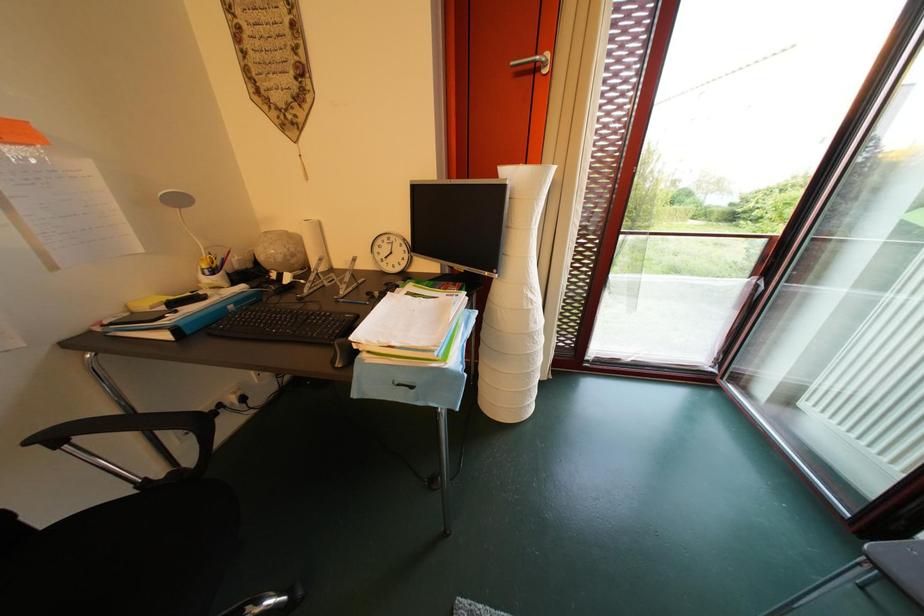
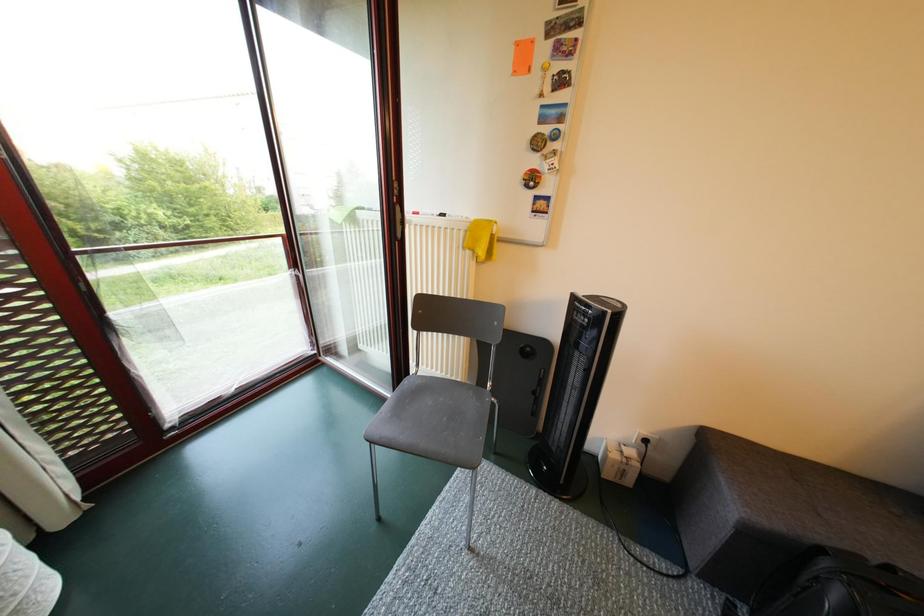
Question: The camera is either moving clockwise (left) or counter-clockwise (right) around the object. The first image is from the beginning of the video and the second image is from the end. Is the camera moving left or right when shooting the video?

Choices:
 (A) Left
 (B) Right

Answer: (A)